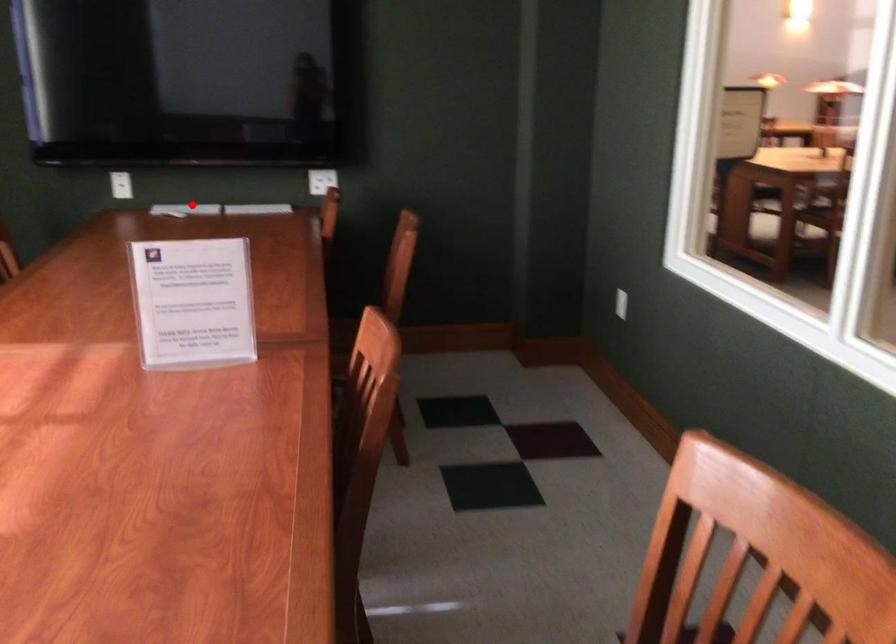
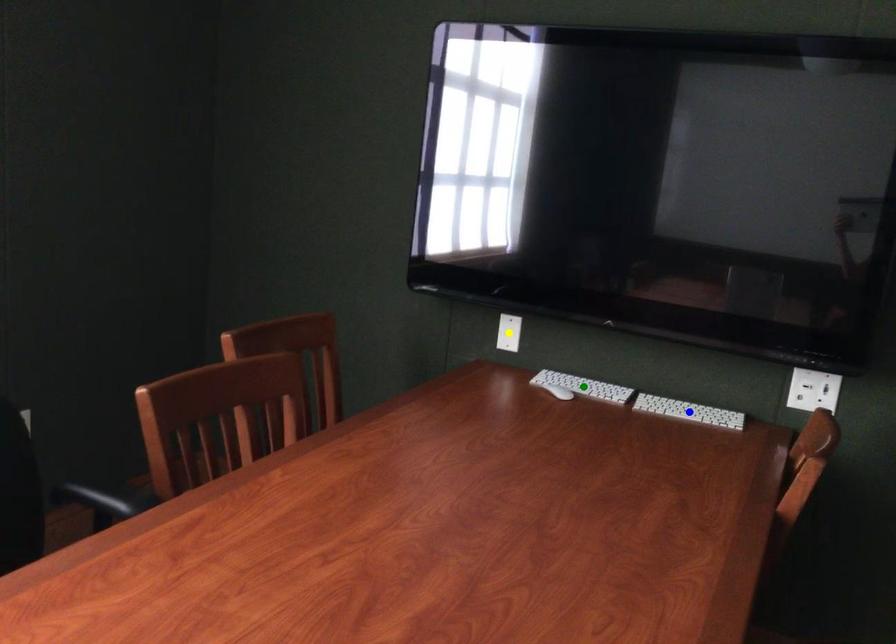
Question: I am providing you with two images of the same scene from different viewpoints. A red point is marked on the first image. You are given multiple points on the second image. Which spot in image 2 lines up with the point in image 1?

Choices:
 (A) green point
 (B) yellow point
 (C) blue point

Answer: (A)